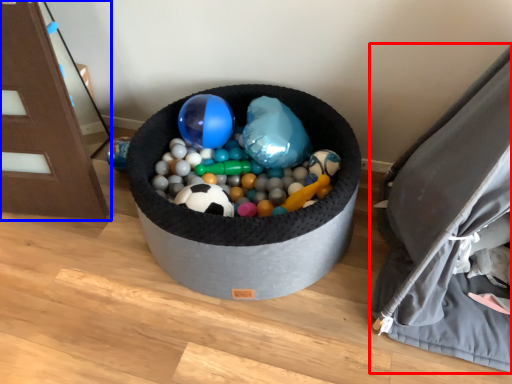
Question: Among these objects, which one is farthest to the camera, bean bag chair (highlighted by a red box) or furniture (highlighted by a blue box)?

Choices:
 (A) bean bag chair
 (B) furniture

Answer: (B)